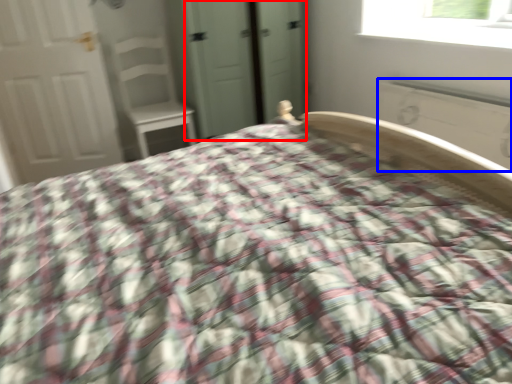
Question: Among these objects, which one is nearest to the camera, screen door (highlighted by a red box) or radiator (highlighted by a blue box)?

Choices:
 (A) screen door
 (B) radiator

Answer: (B)